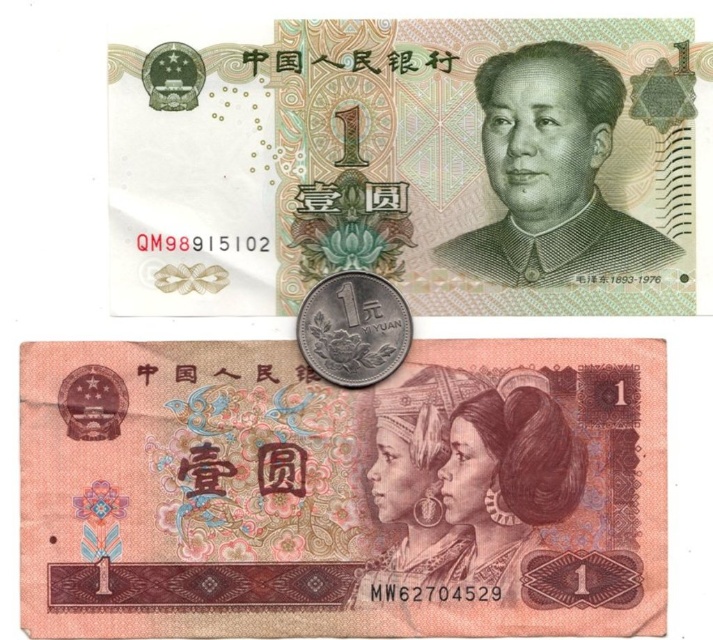
You are holding a wallet and want to store both the smooth paper banknote at center and the matte paper banknote at center. If the wallet has a compartment that can only fit one banknote, which one should you choose to place in the compartment?

The smooth paper banknote at center has a larger size compared to the matte paper banknote at center. Therefore, you should choose the matte paper banknote at center to place in the compartment since it is smaller and more likely to fit.